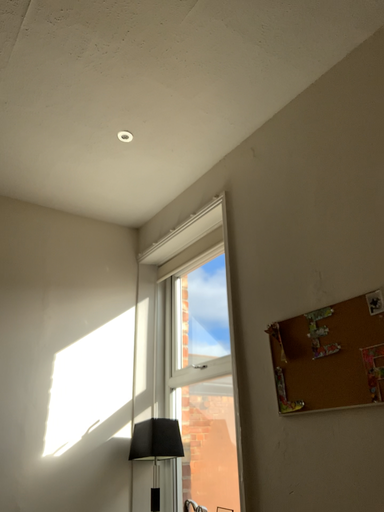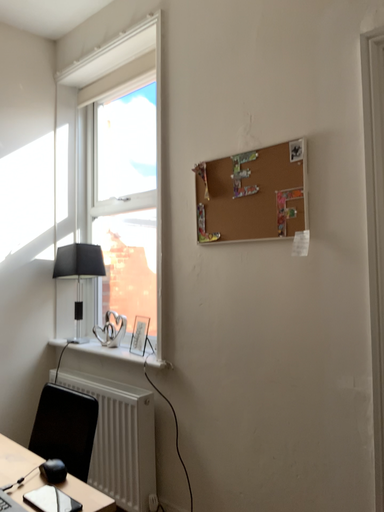
Question: How did the camera likely rotate when shooting the video?

Choices:
 (A) rotated upward
 (B) rotated downward

Answer: (B)